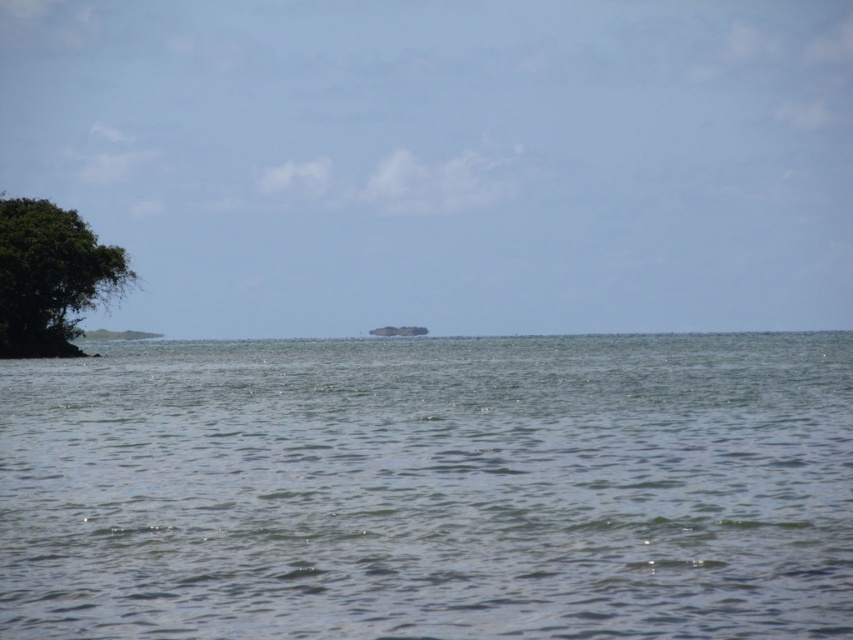
Is point (35, 340) closer to viewer compared to point (405, 324)?

Yes, it is.

Does green leafy tree at left have a greater width compared to green grassy island at center?

In fact, green leafy tree at left might be narrower than green grassy island at center.

Where is `green leafy tree at left`? Image resolution: width=853 pixels, height=640 pixels. green leafy tree at left is located at coordinates (51, 276).

Find the location of a particular element. The image size is (853, 640). clear water at center is located at coordinates (430, 488).

Looking at this image, measure the distance between point (672, 490) and camera.

They are 61.69 feet apart.

Which is behind, point (138, 413) or point (18, 225)?

Point (18, 225)

Where is `clear water at center`? This screenshot has width=853, height=640. clear water at center is located at coordinates (430, 488).

Does clear water at center appear on the right side of green grassy island at center?

Indeed, clear water at center is positioned on the right side of green grassy island at center.

Does clear water at center have a greater height compared to green grassy island at center?

Yes.

Find the location of a particular element. This screenshot has height=640, width=853. clear water at center is located at coordinates (430, 488).